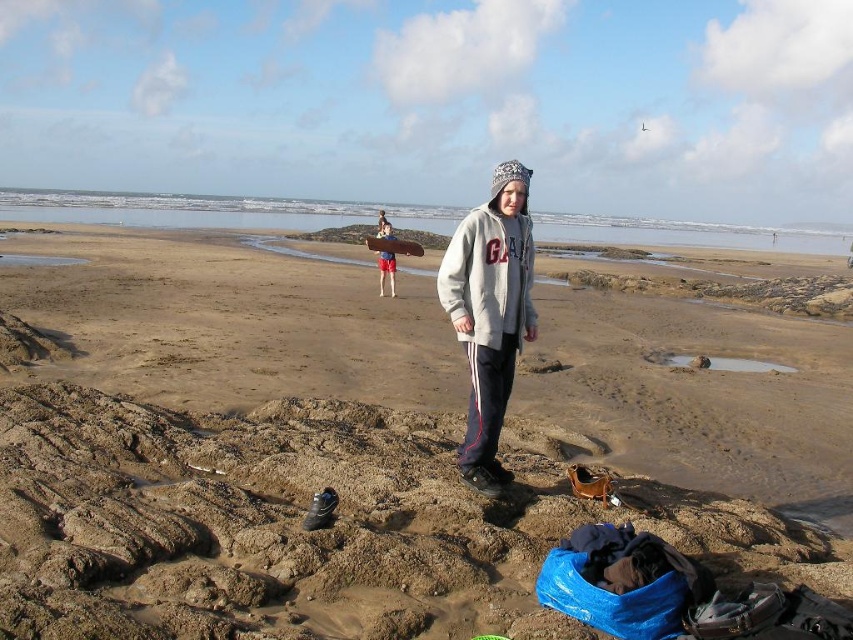
Based on the photo, is brown sand at center to the right of gray fleece sweatshirt at center from the viewer's perspective?

No, brown sand at center is not to the right of gray fleece sweatshirt at center.

Does brown sand at center have a larger size compared to gray fleece sweatshirt at center?

Yes.

Is point (735, 336) more distant than point (494, 246)?

That is True.

The image size is (853, 640). Find the location of `brown sand at center`. brown sand at center is located at coordinates (364, 445).

Is brown sand at center to the left of smooth red shorts at center from the viewer's perspective?

Yes, brown sand at center is to the left of smooth red shorts at center.

Between brown sand at center and smooth red shorts at center, which one has less height?

smooth red shorts at center is shorter.

Does point (397, 480) come closer to viewer compared to point (380, 225)?

Yes, point (397, 480) is closer to viewer.

You are a GUI agent. You are given a task and a screenshot of the screen. Output one action in this format:
    pyautogui.click(x=<x>, y=<y>)
    Task: Click on the brown sand at center
    Image resolution: width=853 pixels, height=640 pixels.
    Given the screenshot: What is the action you would take?
    pyautogui.click(x=364, y=445)

Does gray fleece sweatshirt at center come in front of smooth red shorts at center?

Yes, it is in front of smooth red shorts at center.

Locate an element on the screen. The height and width of the screenshot is (640, 853). gray fleece sweatshirt at center is located at coordinates (474, 275).